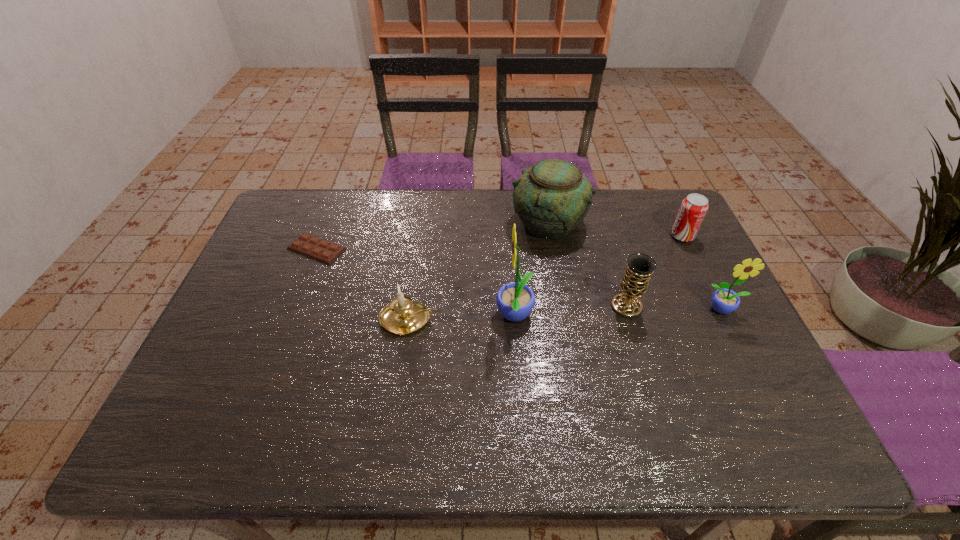
Image resolution: width=960 pixels, height=540 pixels. I want to click on free spot that satisfies the following two spatial constraints: 1. on the front-facing side of the shorter sunflower; 2. on the handle side of the candle holder, so click(728, 320).